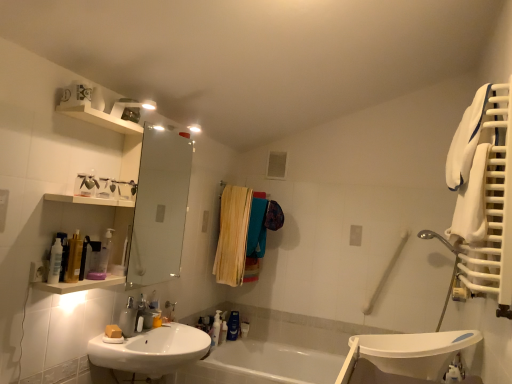
Question: Can you confirm if metallic silver faucet at sink left is taller than translucent plastic pump bottle at lower center, the third toiletry in the right-to-left sequence?

Choices:
 (A) yes
 (B) no

Answer: (B)

Question: From a real-world perspective, does metallic silver faucet at sink left stand above translucent plastic pump bottle at lower center, the third toiletry in the right-to-left sequence?

Choices:
 (A) no
 (B) yes

Answer: (B)

Question: Is metallic silver faucet at sink left surrounding translucent plastic pump bottle at lower center, the first toiletry viewed from the left?

Choices:
 (A) yes
 (B) no

Answer: (B)

Question: Does metallic silver faucet at sink left lie behind translucent plastic pump bottle at lower center, the first toiletry viewed from the left?

Choices:
 (A) yes
 (B) no

Answer: (B)

Question: Is the surface of metallic silver faucet at sink left in direct contact with translucent plastic pump bottle at lower center, the third toiletry in the right-to-left sequence?

Choices:
 (A) yes
 (B) no

Answer: (B)

Question: From the image's perspective, is white soft towel at right above or below white glossy sink at lower left?

Choices:
 (A) below
 (B) above

Answer: (B)

Question: Based on their sizes in the image, would you say white soft towel at right is bigger or smaller than white glossy sink at lower left?

Choices:
 (A) big
 (B) small

Answer: (A)

Question: Is white soft towel at right to the left or to the right of white glossy sink at lower left in the image?

Choices:
 (A) left
 (B) right

Answer: (B)

Question: From a real-world perspective, relative to white glossy sink at lower left, is white soft towel at right vertically above or below?

Choices:
 (A) below
 (B) above

Answer: (B)

Question: From their relative heights in the image, would you say wooden laundry at center is taller or shorter than matte yellow soap at sink left?

Choices:
 (A) tall
 (B) short

Answer: (A)

Question: From the image's perspective, is wooden laundry at center positioned above or below matte yellow soap at sink left?

Choices:
 (A) below
 (B) above

Answer: (B)

Question: In the image, is wooden laundry at center on the left side or the right side of matte yellow soap at sink left?

Choices:
 (A) right
 (B) left

Answer: (A)

Question: Is wooden laundry at center inside or outside of matte yellow soap at sink left?

Choices:
 (A) outside
 (B) inside

Answer: (A)

Question: Considering the positions of white glossy bathtub at center and translucent plastic bottle at lower center, the second toiletry when ordered from right to left, in the image, is white glossy bathtub at center wider or thinner than translucent plastic bottle at lower center, the second toiletry when ordered from right to left,?

Choices:
 (A) thin
 (B) wide

Answer: (B)

Question: Looking at the image, does white glossy bathtub at center seem bigger or smaller compared to translucent plastic bottle at lower center, the second toiletry when ordered from right to left?

Choices:
 (A) small
 (B) big

Answer: (B)